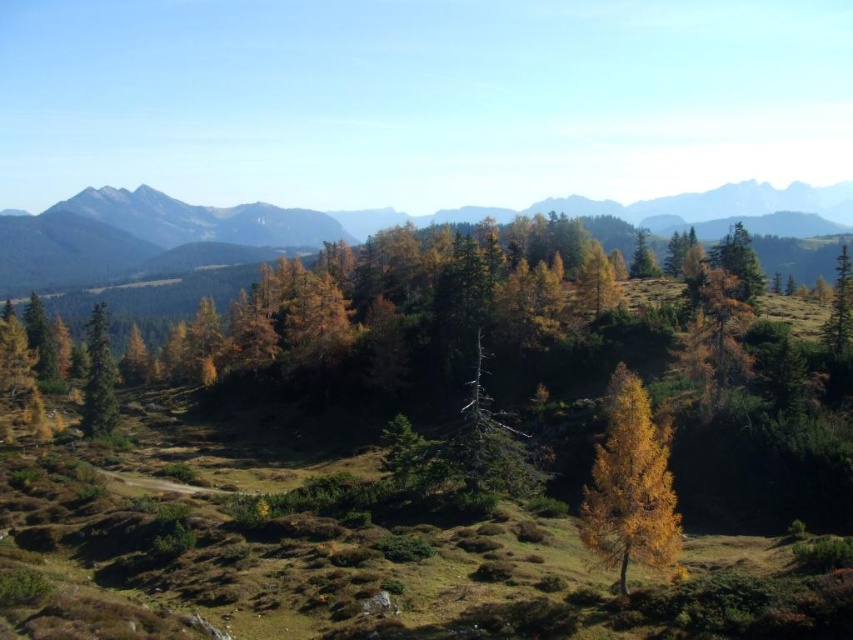
You are planning to plant a new tree in your backyard. You want to know which tree between the yellow larch tree at center and the green matte tree at left would require more space horizontally. Based on the image, which tree should you choose?

The green matte tree at left should be chosen because its width is greater than the yellow larch tree at center, meaning it requires more horizontal space.

You are an outdoor enthusiast planning a hiking route. You see the green textured mountain range at center and the green matte tree at upper right in the distance. Which of these two landmarks is positioned higher in the visual field?

The green textured mountain range at center is positioned higher in the visual field than the green matte tree at upper right because it is described as being above it.

You are a hiker trying to locate the green textured mountain range at center. According to the map, the mountain range is at coordinates point 0.359, 0.399. Are you currently facing the correct direction to see it?

Yes, the green textured mountain range at center is located at point (339, 228), so if you are facing that coordinate, you are facing the correct direction to see it.